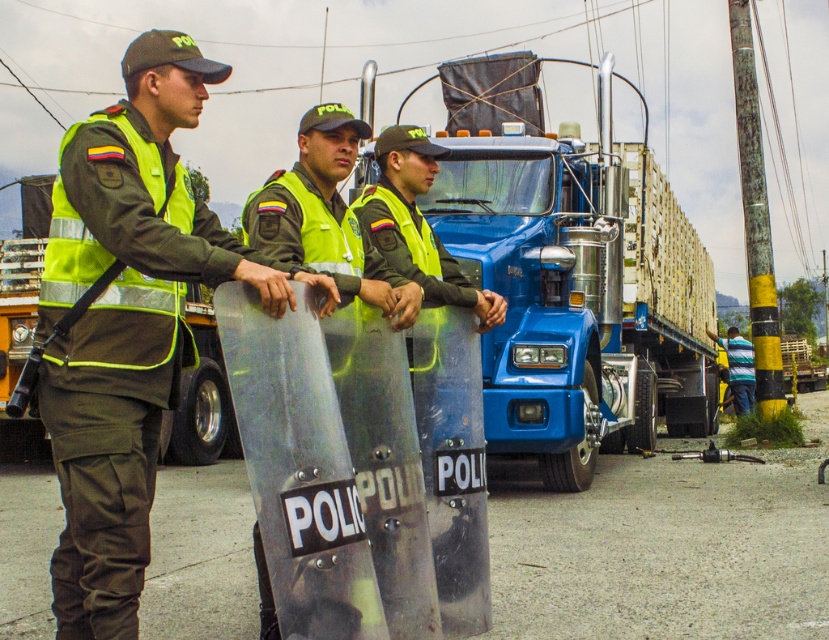
Between blue metallic truck at center and metallic silver shield at center, which one has more height?

blue metallic truck at center

Between point (537, 202) and point (289, 195), which one is positioned behind?

Point (537, 202)

Find the location of a particular element. The image size is (829, 640). blue metallic truck at center is located at coordinates (571, 280).

Is point (83, 371) positioned behind point (750, 380)?

No, (83, 371) is in front of (750, 380).

Who is shorter, green matte uniform at left or striped cotton shirt at lower right?

Standing shorter between the two is striped cotton shirt at lower right.

What are the coordinates of `green matte uniform at left` in the screenshot? It's located at (127, 321).

What are the coordinates of `green matte uniform at left` in the screenshot? It's located at (127, 321).

Measure the distance between green matte uniform at left and metallic silver shield at center.

A distance of 33.82 inches exists between green matte uniform at left and metallic silver shield at center.

Is green matte uniform at left above metallic silver shield at center?

No.

What do you see at coordinates (127, 321) in the screenshot? I see `green matte uniform at left` at bounding box center [127, 321].

This screenshot has height=640, width=829. In order to click on green matte uniform at left in this screenshot , I will do `click(127, 321)`.